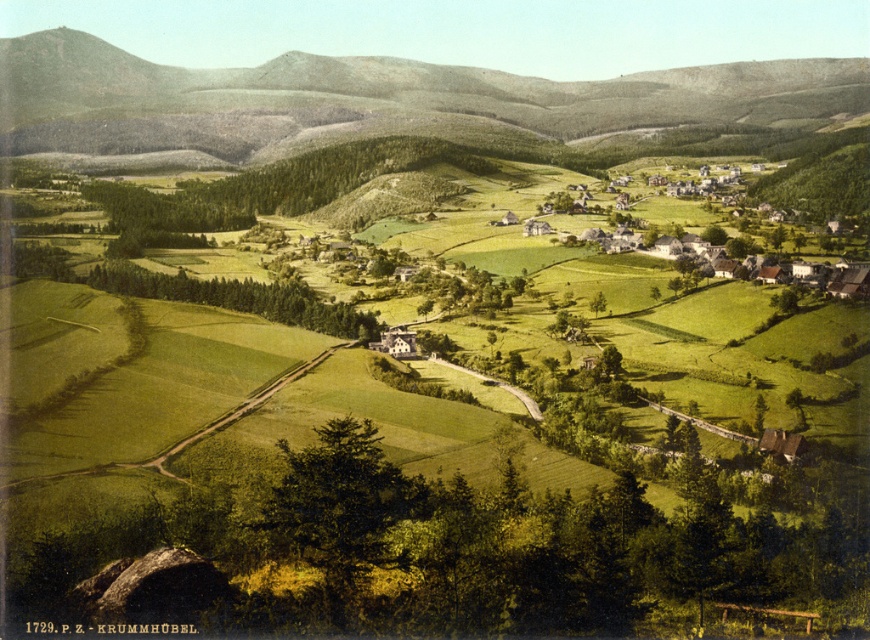
You are standing at the point marked as point (372,99) in the image. Looking around, what type of terrain are you currently on?

The point (372,99) is on a green textured hillside at upper center, so you are standing on a hillside covered in green vegetation.